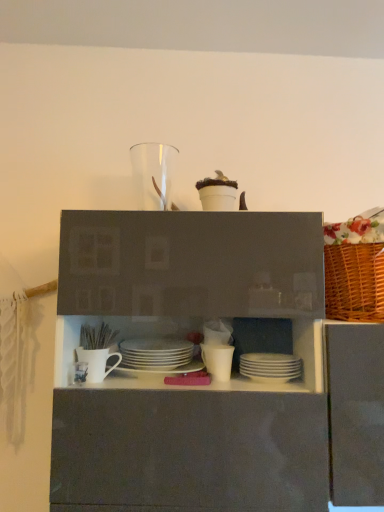
Question: From the image's perspective, is transparent glass vase at upper center, the fourth tableware viewed from the right, above or below white matte cup at center, the fifth tableware positioned from the left?

Choices:
 (A) above
 (B) below

Answer: (A)

Question: Choose the correct answer: Is transparent glass vase at upper center, the fourth tableware viewed from the right, inside white matte cup at center, the 2th tableware from the bottom, or outside it?

Choices:
 (A) outside
 (B) inside

Answer: (A)

Question: Which of these objects is positioned farthest from the transparent glass vase at upper center, which is counted as the 6th tableware, starting from the bottom?

Choices:
 (A) white glossy plates at center, which is the fourth tableware from left to right
 (B) white matte mug at center, which is the second tableware from top to bottom
 (C) white matte cup at center, the 2th tableware from the bottom
 (D) white matte mug at center, acting as the 4th tableware starting from the top
 (E) white matte plates at center, which is the 6th tableware from left to right

Answer: (E)

Question: Which is nearer to the transparent glass vase at upper center, positioned as the first tableware in top-to-bottom order?

Choices:
 (A) white matte mug at center, which is the second tableware from top to bottom
 (B) white matte mug at center, arranged as the 6th tableware when viewed from the right
 (C) white matte plates at center, which is the 6th tableware from left to right
 (D) white glossy plates at center, arranged as the 3th tableware when viewed from the top
 (E) white matte cup at center, the 2th tableware from the bottom

Answer: (D)